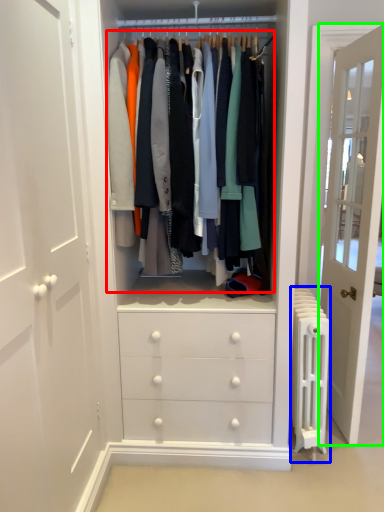
Question: Which is farther away from closet (highlighted by a red box)? radiator (highlighted by a blue box) or door (highlighted by a green box)?

Choices:
 (A) radiator
 (B) door

Answer: (B)